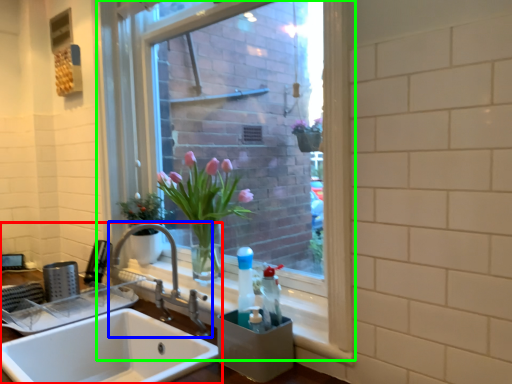
Question: Which object is the farthest from sink (highlighted by a red box)? Choose among these: tap (highlighted by a blue box) or window (highlighted by a green box).

Choices:
 (A) tap
 (B) window

Answer: (B)